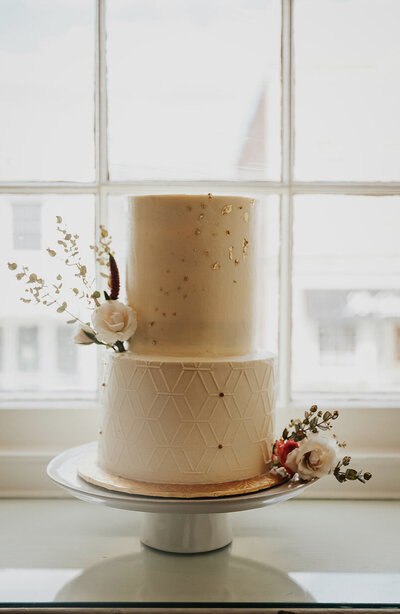
Image resolution: width=400 pixels, height=614 pixels. I want to click on cake stand, so click(163, 508).